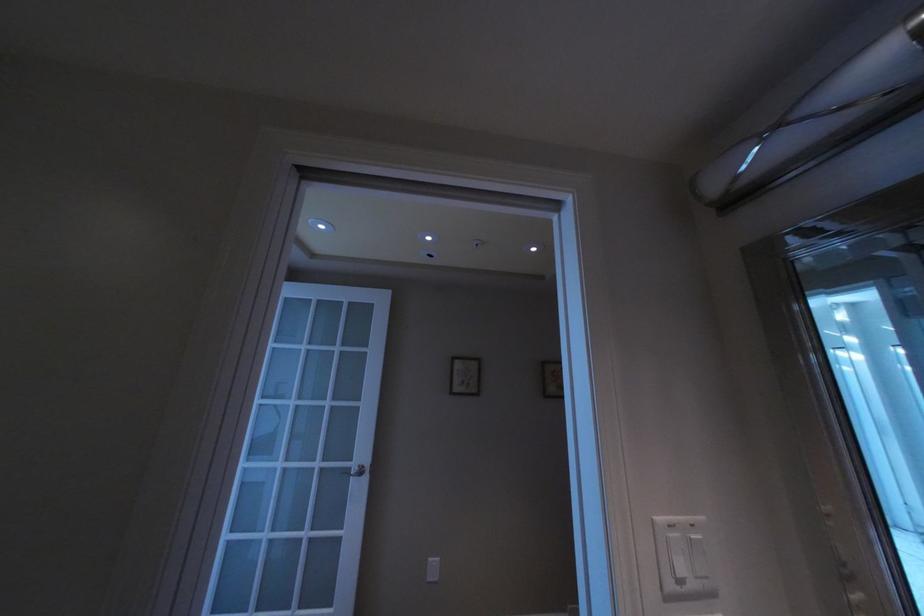
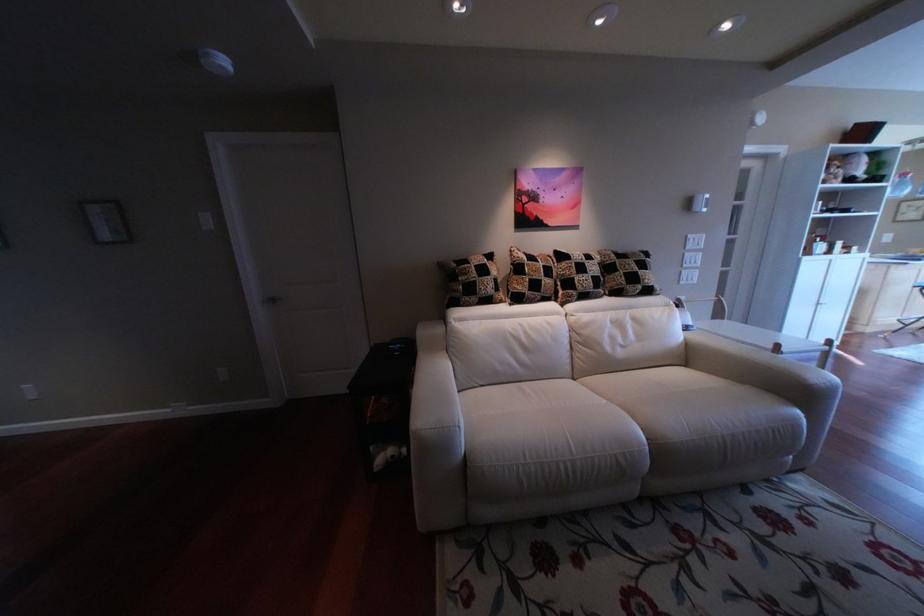
Question: Which direction would the cameraman need to move to produce the second image? Reply with the corresponding letter.

Choices:
 (A) Left
 (B) Right
 (C) Forward
 (D) Backward

Answer: (B)